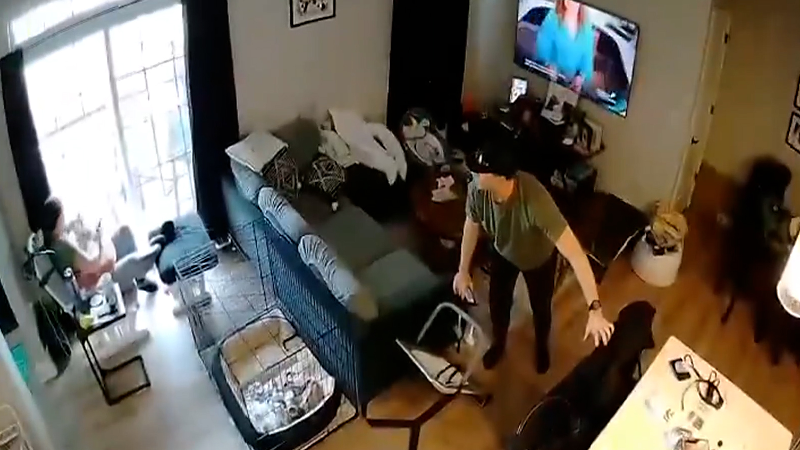
Locate an element on the screen. The image size is (800, 450). tv is located at coordinates (610, 64).